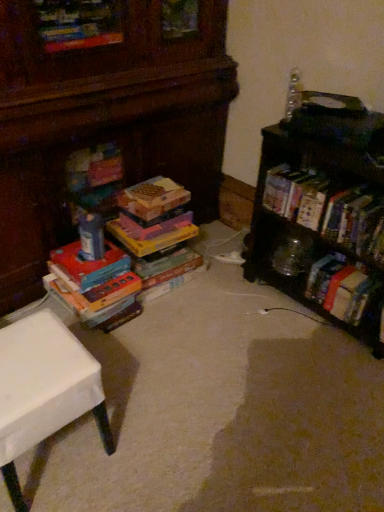
This screenshot has height=512, width=384. What are the coordinates of `white matte table at lower left` in the screenshot? It's located at (44, 390).

The image size is (384, 512). What do you see at coordinates (92, 283) in the screenshot?
I see `multicolored cardboard books at left, the 2th book in the right-to-left sequence` at bounding box center [92, 283].

This screenshot has width=384, height=512. Describe the element at coordinates (322, 228) in the screenshot. I see `wooden bookshelf at right` at that location.

Describe the element at coordinates (91, 236) in the screenshot. I see `matte plastic toy at center, marked as the first toy in a bottom-to-top arrangement` at that location.

I want to click on hardcover book at right, arranged as the 2th book when viewed from the left, so click(341, 288).

Can you tell me how much wooden bookshelf at right and clear plastic bottle at upper right, marked as the first toy in a right-to-left arrangement, differ in facing direction?

2.36 degrees separate the facing orientations of wooden bookshelf at right and clear plastic bottle at upper right, marked as the first toy in a right-to-left arrangement.

Where is `shelf on the right side of clear plastic bottle at upper right, which is the second toy from left to right`? shelf on the right side of clear plastic bottle at upper right, which is the second toy from left to right is located at coordinates (322, 228).

Can you confirm if wooden bookshelf at right is shorter than clear plastic bottle at upper right, marked as the first toy in a right-to-left arrangement?

No, wooden bookshelf at right is not shorter than clear plastic bottle at upper right, marked as the first toy in a right-to-left arrangement.

Between wooden bookshelf at right and clear plastic bottle at upper right, the 1th toy from the top, which one is positioned in front?

wooden bookshelf at right is in front.

From a real-world perspective, is white matte table at lower left positioned above or below hardcover book at right, arranged as the 2th book when viewed from the left?

Clearly, from a real-world perspective, white matte table at lower left is above hardcover book at right, arranged as the 2th book when viewed from the left.

Looking at their sizes, would you say white matte table at lower left is wider or thinner than hardcover book at right, the 1th book positioned from the right?

Considering their sizes, white matte table at lower left looks broader than hardcover book at right, the 1th book positioned from the right.

In terms of size, does white matte table at lower left appear bigger or smaller than hardcover book at right, the 1th book positioned from the right?

In the image, white matte table at lower left appears to be larger than hardcover book at right, the 1th book positioned from the right.

Is white matte table at lower left not within hardcover book at right, the 1th book positioned from the right?

Yes, white matte table at lower left is outside of hardcover book at right, the 1th book positioned from the right.

Visually, is matte plastic toy at center, which is the first toy from left to right, positioned to the left or to the right of multicolored cardboard books at left, which is the first book in left-to-right order?

matte plastic toy at center, which is the first toy from left to right, is to the right of multicolored cardboard books at left, which is the first book in left-to-right order.

Does matte plastic toy at center, marked as the first toy in a bottom-to-top arrangement, touch multicolored cardboard books at left, which is the first book in left-to-right order?

There is a gap between matte plastic toy at center, marked as the first toy in a bottom-to-top arrangement, and multicolored cardboard books at left, which is the first book in left-to-right order.

Considering the relative sizes of matte plastic toy at center, the second toy in the top-to-bottom sequence, and multicolored cardboard books at left, the 2th book in the right-to-left sequence, in the image provided, is matte plastic toy at center, the second toy in the top-to-bottom sequence, bigger than multicolored cardboard books at left, the 2th book in the right-to-left sequence,?

No, matte plastic toy at center, the second toy in the top-to-bottom sequence, is not bigger than multicolored cardboard books at left, the 2th book in the right-to-left sequence.

Is matte plastic toy at center, which is the second toy from right to left, oriented away from multicolored cardboard books at left, which is the first book in left-to-right order?

matte plastic toy at center, which is the second toy from right to left, does not have its back to multicolored cardboard books at left, which is the first book in left-to-right order.

Which object is closer to the camera, wooden bookshelf at right or matte plastic toy at center, the second toy in the top-to-bottom sequence?

wooden bookshelf at right.

Consider the image. Considering the positions of objects wooden bookshelf at right and matte plastic toy at center, marked as the first toy in a bottom-to-top arrangement, in the image provided, who is more to the right, wooden bookshelf at right or matte plastic toy at center, marked as the first toy in a bottom-to-top arrangement,?

wooden bookshelf at right is more to the right.

Between point (344, 226) and point (95, 251), which one is positioned behind?

The point (95, 251) is farther from the camera.

Is wooden bookshelf at right positioned with its back to matte plastic toy at center, the second toy in the top-to-bottom sequence?

No, wooden bookshelf at right is not facing the opposite direction of matte plastic toy at center, the second toy in the top-to-bottom sequence.

How far apart are wooden bookshelf at right and multicolored cardboard books at left, which is the first book in left-to-right order?

The distance of wooden bookshelf at right from multicolored cardboard books at left, which is the first book in left-to-right order, is 90.39 centimeters.

From a real-world perspective, is wooden bookshelf at right above or below multicolored cardboard books at left, the 2th book in the right-to-left sequence?

From a real-world perspective, wooden bookshelf at right is physically above multicolored cardboard books at left, the 2th book in the right-to-left sequence.

Is point (295, 142) positioned after point (93, 325)?

No, it is in front of (93, 325).

Which object is positioned more to the left, clear plastic bottle at upper right, the 1th toy from the top, or white matte table at lower left?

white matte table at lower left is more to the left.

Consider the image. How many degrees apart are the facing directions of clear plastic bottle at upper right, marked as the first toy in a right-to-left arrangement, and white matte table at lower left?

There is a 88.3-degree angle between the facing directions of clear plastic bottle at upper right, marked as the first toy in a right-to-left arrangement, and white matte table at lower left.

From the image's perspective, is clear plastic bottle at upper right, which is the second toy from left to right, beneath white matte table at lower left?

No.

From a real-world perspective, is matte plastic toy at center, marked as the first toy in a bottom-to-top arrangement, physically located above or below clear plastic bottle at upper right, the 1th toy from the top?

In terms of real-world spatial position, matte plastic toy at center, marked as the first toy in a bottom-to-top arrangement, is below clear plastic bottle at upper right, the 1th toy from the top.

Which is in front, point (80, 229) or point (301, 84)?

The point (80, 229) is more forward.

Identify the location of toy below the clear plastic bottle at upper right, which is the second toy from left to right (from the image's perspective). The image size is (384, 512). (91, 236).

Is matte plastic toy at center, which is the second toy from right to left, further to the viewer compared to clear plastic bottle at upper right, which is the second toy from left to right?

Result: Yes, matte plastic toy at center, which is the second toy from right to left, is further from the viewer.

Find the location of a particular element. toy that is above the wooden bookshelf at right (from a real-world perspective) is located at coordinates (293, 96).

In order to click on table below the hardcover book at right, the 1th book positioned from the right (from the image's perspective) in this screenshot , I will do point(44,390).

Considering their positions, is multicolored cardboard books at left, which is the first book in left-to-right order, positioned further to clear plastic bottle at upper right, marked as the first toy in a right-to-left arrangement, than hardcover book at right, arranged as the 2th book when viewed from the left?

Based on the image, multicolored cardboard books at left, which is the first book in left-to-right order, appears to be further to clear plastic bottle at upper right, marked as the first toy in a right-to-left arrangement.

When comparing their distances from matte plastic toy at center, which is the first toy from left to right, does wooden bookshelf at right or multicolored cardboard books at left, the 2th book in the right-to-left sequence, seem further?

The object further to matte plastic toy at center, which is the first toy from left to right, is wooden bookshelf at right.

Which object lies nearer to the anchor point wooden bookshelf at right, hardcover book at right, the 1th book positioned from the right, or multicolored cardboard books at left, the 2th book in the right-to-left sequence?

hardcover book at right, the 1th book positioned from the right, is positioned closer to the anchor wooden bookshelf at right.

Based on their spatial positions, is wooden bookshelf at right or multicolored cardboard books at left, the 2th book in the right-to-left sequence, closer to hardcover book at right, arranged as the 2th book when viewed from the left?

wooden bookshelf at right.

From the image, which object appears to be nearer to multicolored cardboard books at left, the 2th book in the right-to-left sequence, wooden bookshelf at right or hardcover book at right, arranged as the 2th book when viewed from the left?

The object closer to multicolored cardboard books at left, the 2th book in the right-to-left sequence, is wooden bookshelf at right.

Considering their positions, is wooden bookshelf at right positioned closer to multicolored cardboard books at left, which is the first book in left-to-right order, than clear plastic bottle at upper right, the 1th toy from the top?

Among the two, wooden bookshelf at right is located nearer to multicolored cardboard books at left, which is the first book in left-to-right order.

Based on their spatial positions, is clear plastic bottle at upper right, the 1th toy from the top, or wooden bookshelf at right closer to white matte table at lower left?

wooden bookshelf at right is positioned closer to the anchor white matte table at lower left.

Looking at the image, which one is located closer to white matte table at lower left, clear plastic bottle at upper right, marked as the first toy in a right-to-left arrangement, or multicolored cardboard books at left, the 2th book in the right-to-left sequence?

multicolored cardboard books at left, the 2th book in the right-to-left sequence, is positioned closer to the anchor white matte table at lower left.

In order to click on book between white matte table at lower left and hardcover book at right, the 1th book positioned from the right in this screenshot , I will do `click(92, 283)`.

This screenshot has height=512, width=384. Identify the location of toy between clear plastic bottle at upper right, which is the second toy from left to right, and white matte table at lower left from top to bottom. (91, 236).

In order to click on book between white matte table at lower left and wooden bookshelf at right from left to right in this screenshot , I will do `click(92, 283)`.

Identify the location of book located between white matte table at lower left and matte plastic toy at center, the second toy in the top-to-bottom sequence, in the depth direction. [x=92, y=283].